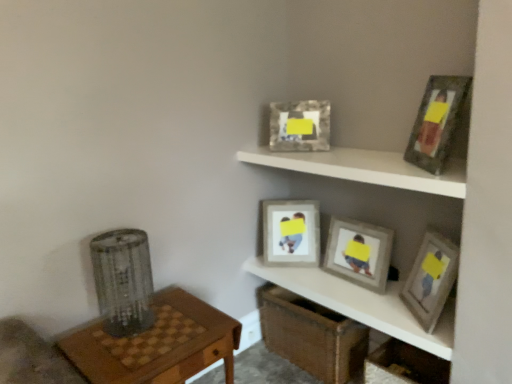
Question: In terms of height, does wooden picture frames at center, acting as the 2th shelf starting from the top, look taller or shorter compared to white matte shelf at upper center, placed as the 1th shelf when sorted from top to bottom?

Choices:
 (A) tall
 (B) short

Answer: (B)

Question: In the image, is wooden picture frames at center, acting as the 2th shelf starting from the top, on the left side or the right side of white matte shelf at upper center, which is counted as the 2th shelf, starting from the bottom?

Choices:
 (A) left
 (B) right

Answer: (B)

Question: Estimate the real-world distances between objects in this image. Which object is closer to the woven brown crate at lower center?

Choices:
 (A) metallic silver picture frame at upper center, acting as the 2th picture frame starting from the back
 (B) wooden picture frame at upper right, the 5th picture frame in the back-to-front sequence
 (C) matte gray picture frame at upper right, which appears as the fourth picture frame when viewed from the back
 (D) white matte shelf at upper center, which is counted as the 2th shelf, starting from the bottom
 (E) matte gray picture frame at center, which appears as the 5th picture frame when viewed from the front

Answer: (E)

Question: Which is nearer to the matte gray picture frame at center, the 3th picture frame when ordered from front to back?

Choices:
 (A) wooden picture frames at center, acting as the 2th shelf starting from the top
 (B) wooden at left
 (C) woven brown crate at lower center
 (D) matte gray picture frame at center, which ranks as the 1th picture frame in back-to-front order
 (E) metallic silver picture frame at upper center, acting as the 2th picture frame starting from the back

Answer: (A)